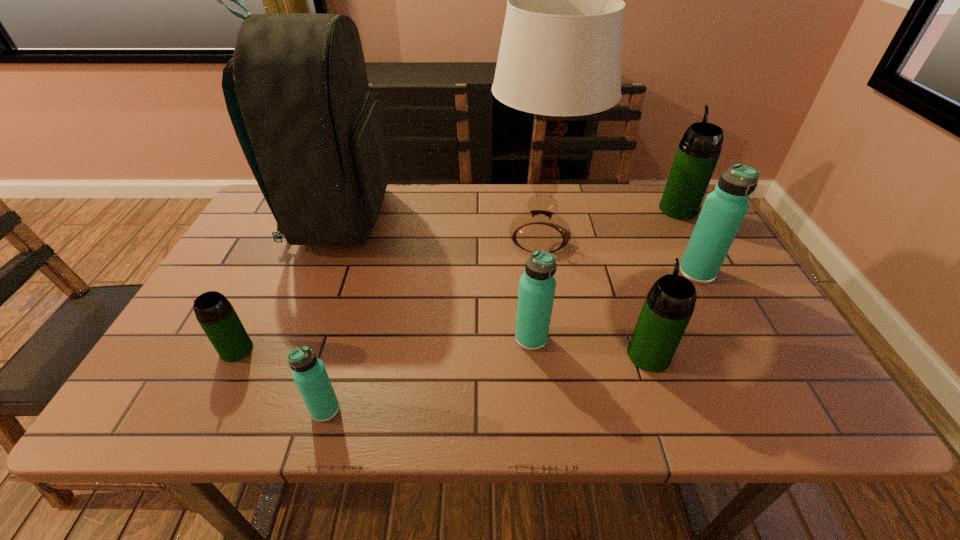
Where is `the leftmost green thermos bottle`? This screenshot has height=540, width=960. the leftmost green thermos bottle is located at coordinates (216, 315).

The width and height of the screenshot is (960, 540). Identify the location of the smallest green thermos bottle. (216, 315).

Where is `the nearest object`? The height and width of the screenshot is (540, 960). the nearest object is located at coordinates (309, 373).

At what (x,y) coordinates should I click in order to perform the action: click on the nearest aqua thermos bottle. Please return your answer as a coordinate pair (x, y). The height and width of the screenshot is (540, 960). Looking at the image, I should click on point(309,373).

Where is `free space located on the front-facing side of the gray backpack`? This screenshot has height=540, width=960. free space located on the front-facing side of the gray backpack is located at coordinates point(414,219).

Find the location of a particular element. vacant space located 0.330m on the front-facing side of the table lamp is located at coordinates (371, 238).

Locate an element on the screen. This screenshot has height=540, width=960. free location located 0.250m on the front-facing side of the table lamp is located at coordinates (399, 238).

Locate an element on the screen. The width and height of the screenshot is (960, 540). vacant space located 0.060m on the front-facing side of the table lamp is located at coordinates (468, 238).

You are a GUI agent. You are given a task and a screenshot of the screen. Output one action in this format:
    pyautogui.click(x=<x>, y=<y>)
    Task: Click on the vacant position located 0.070m from the spout of the farthest green thermos bottle
    
    Given the screenshot: What is the action you would take?
    pyautogui.click(x=665, y=187)

This screenshot has width=960, height=540. I want to click on blank area located on the left of the rightmost aqua thermos bottle, so click(625, 272).